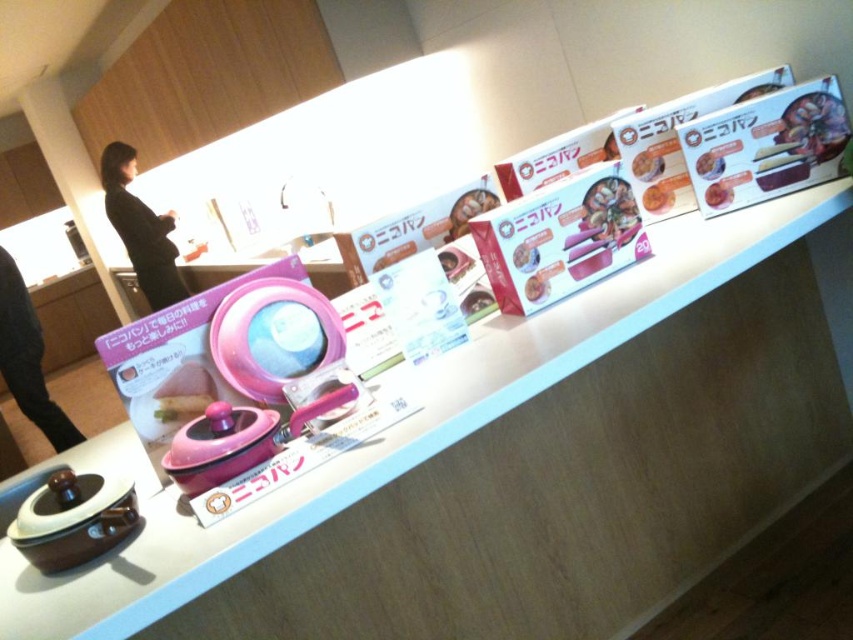
You are a customer in a kitchenware store looking at the display. You see a white glossy counter top at upper center and a black fabric at left. Which object is positioned to the right of the other?

The white glossy counter top at upper center is positioned to the right of the black fabric at left.

You are a customer looking at the display. The black fabric at left is partially covering some items. Can you see the matte pink rice cooker at upper center clearly?

The matte pink rice cooker at upper center is behind the black fabric at left, so it might be partially obscured and not clearly visible.

You are a customer standing in front of the shelf and want to reach the two points marked as point (136, 241) and point (10, 304). Which point will require you to reach further back on the shelf?

Point (10, 304) requires reaching further back on the shelf because it is closer to the shelf and farther from the camera compared to point (136, 241).